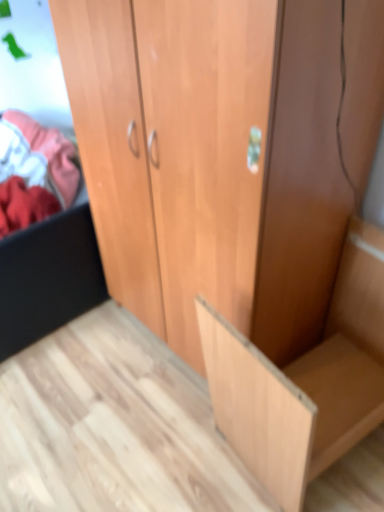
At what (x,y) coordinates should I click in order to perform the action: click on vacant space situated on the left part of light wood cabinet at lower right. Please return your answer as a coordinate pair (x, y). Looking at the image, I should click on point(159,436).